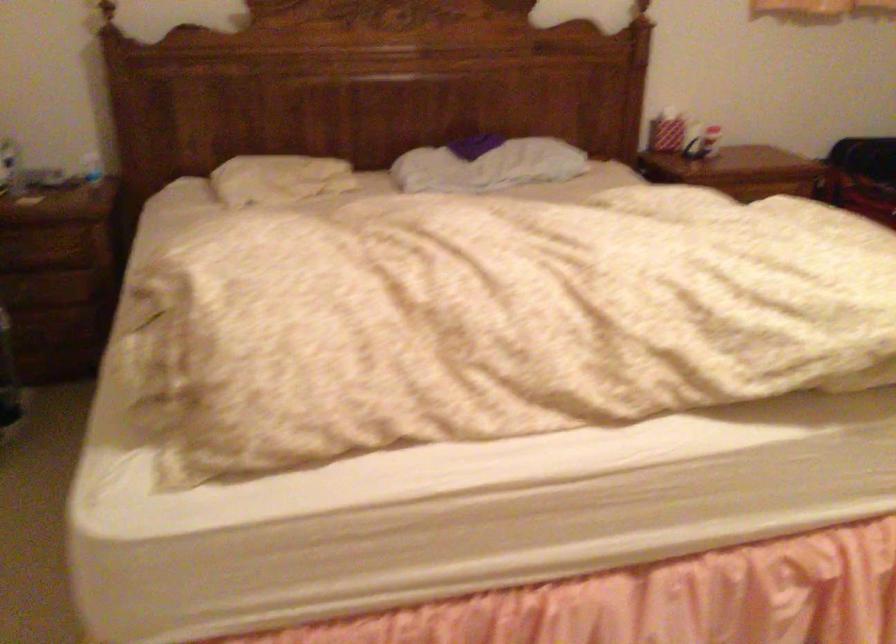
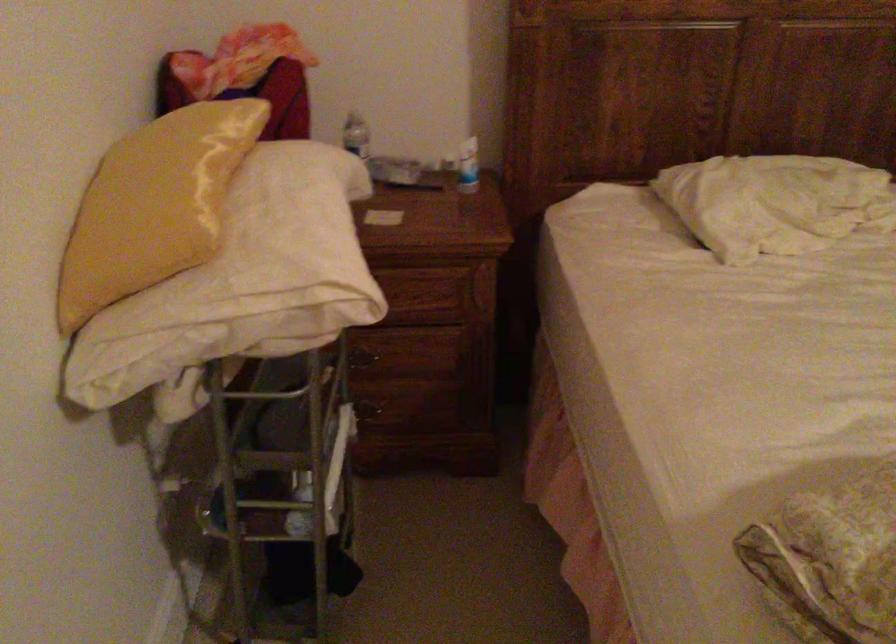
Locate, in the second image, the point that corresponds to the point at 91,169 in the first image.

(468, 166)